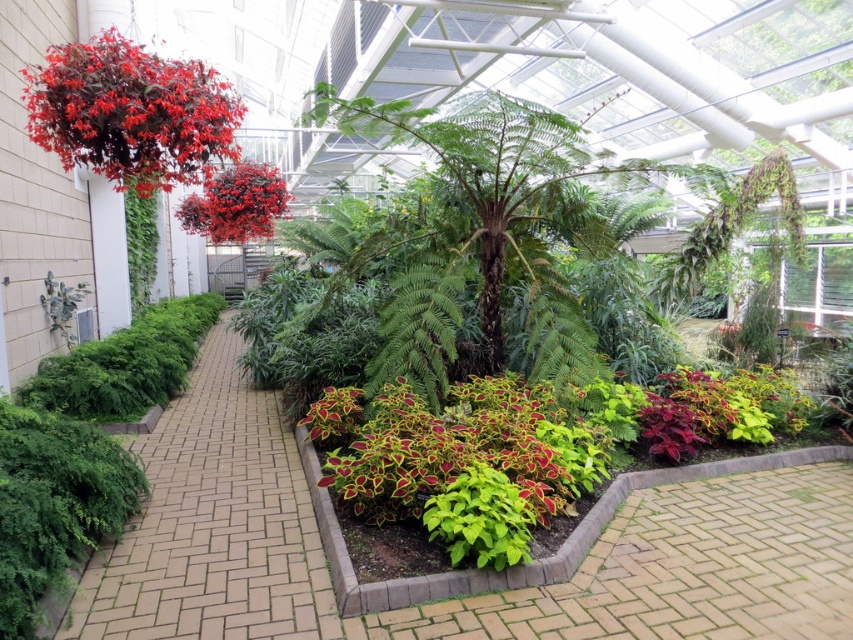
Question: Considering the real-world distances, which object is closest to the lush green foliage at center?

Choices:
 (A) matte red hanging basket at upper left
 (B) green leafy tree at center
 (C) glossy red berries at upper center

Answer: (B)

Question: Which of the following is the farthest from the observer?

Choices:
 (A) (306, 579)
 (B) (508, 138)

Answer: (B)

Question: In this image, where is lush green foliage at center located relative to glossy red berries at upper center?

Choices:
 (A) right
 (B) left

Answer: (A)

Question: Is green leafy tree at center smaller than lush green foliage at center?

Choices:
 (A) no
 (B) yes

Answer: (A)

Question: Does lush green foliage at center appear under glossy red berries at upper center?

Choices:
 (A) no
 (B) yes

Answer: (B)

Question: Which point is farther to the camera?

Choices:
 (A) matte red hanging basket at upper left
 (B) green leafy tree at center

Answer: (B)